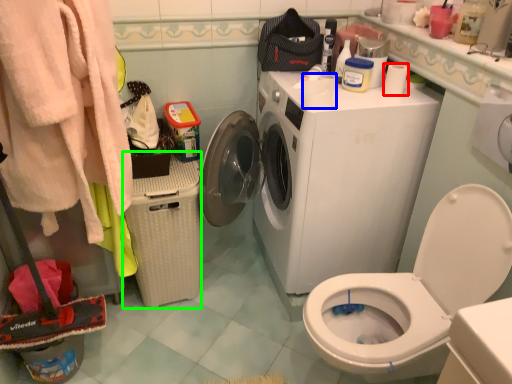
Question: Estimate the real-world distances between objects in this image. Which object is closer to toilet paper (highlighted by a red box), toilet paper (highlighted by a blue box) or laundry basket (highlighted by a green box)?

Choices:
 (A) toilet paper
 (B) laundry basket

Answer: (A)